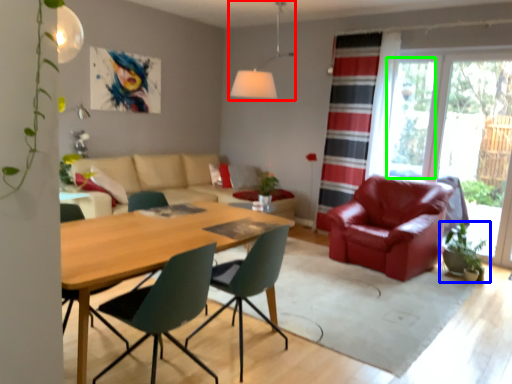
Question: Based on their relative distances, which object is farther from light fixture (highlighted by a red box)? Choose from houseplant (highlighted by a blue box) and window screen (highlighted by a green box).

Choices:
 (A) houseplant
 (B) window screen

Answer: (A)